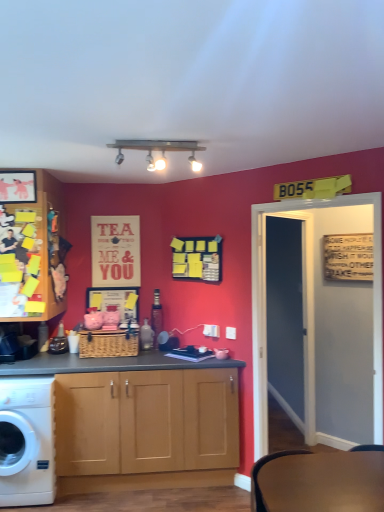
Question: Can you confirm if woven brown picnic basket at center is wider than matte paper poster at upper center?

Choices:
 (A) no
 (B) yes

Answer: (B)

Question: Does woven brown picnic basket at center contain matte paper poster at upper center?

Choices:
 (A) no
 (B) yes

Answer: (A)

Question: From a real-world perspective, is woven brown picnic basket at center positioned under matte paper poster at upper center based on gravity?

Choices:
 (A) no
 (B) yes

Answer: (B)

Question: Considering the relative sizes of woven brown picnic basket at center and matte paper poster at upper center in the image provided, is woven brown picnic basket at center shorter than matte paper poster at upper center?

Choices:
 (A) no
 (B) yes

Answer: (B)

Question: Is woven brown picnic basket at center directly adjacent to matte paper poster at upper center?

Choices:
 (A) yes
 (B) no

Answer: (B)

Question: Considering the positions of point (132, 274) and point (21, 173), is point (132, 274) closer or farther from the camera than point (21, 173)?

Choices:
 (A) closer
 (B) farther

Answer: (B)

Question: From the image's perspective, is matte paper poster at upper center above or below matte black picture frame at upper left?

Choices:
 (A) below
 (B) above

Answer: (A)

Question: Is matte paper poster at upper center in front of or behind matte black picture frame at upper left in the image?

Choices:
 (A) front
 (B) behind

Answer: (B)

Question: Is matte paper poster at upper center situated inside matte black picture frame at upper left or outside?

Choices:
 (A) inside
 (B) outside

Answer: (B)

Question: From the image's perspective, relative to matte paper poster at upper center, is matte black picture frame at upper left above or below?

Choices:
 (A) below
 (B) above

Answer: (B)

Question: Is matte black picture frame at upper left in front of or behind matte paper poster at upper center in the image?

Choices:
 (A) front
 (B) behind

Answer: (A)

Question: Would you say matte black picture frame at upper left is to the left or to the right of matte paper poster at upper center in the picture?

Choices:
 (A) left
 (B) right

Answer: (A)

Question: In terms of size, does matte black picture frame at upper left appear bigger or smaller than matte paper poster at upper center?

Choices:
 (A) big
 (B) small

Answer: (B)

Question: Looking at the image, does wooden cabinet at left seem bigger or smaller compared to woven brown picnic basket at center?

Choices:
 (A) small
 (B) big

Answer: (B)

Question: From the image's perspective, relative to woven brown picnic basket at center, is wooden cabinet at left above or below?

Choices:
 (A) below
 (B) above

Answer: (B)